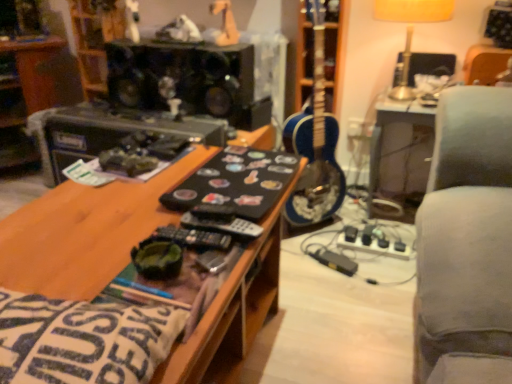
Question: Does white matte toy at upper center, which is counted as the first toy, starting from the left, have a lesser height compared to black matte speaker at upper center?

Choices:
 (A) yes
 (B) no

Answer: (A)

Question: Is white matte toy at upper center, which is counted as the first toy, starting from the left, positioned in front of black matte speaker at upper center?

Choices:
 (A) yes
 (B) no

Answer: (B)

Question: From a real-world perspective, is white matte toy at upper center, which is counted as the first toy, starting from the left, below black matte speaker at upper center?

Choices:
 (A) yes
 (B) no

Answer: (B)

Question: Is white matte toy at upper center, which is counted as the first toy, starting from the left, taller than black matte speaker at upper center?

Choices:
 (A) no
 (B) yes

Answer: (A)

Question: Would you say white matte toy at upper center, which is counted as the third toy, starting from the right, contains black matte speaker at upper center?

Choices:
 (A) yes
 (B) no

Answer: (B)

Question: From the image's perspective, is white fabric pillow at lower left positioned above or below black plastic shelf at upper left?

Choices:
 (A) below
 (B) above

Answer: (A)

Question: Do you think white fabric pillow at lower left is within black plastic shelf at upper left, or outside of it?

Choices:
 (A) outside
 (B) inside

Answer: (A)

Question: Considering the positions of white fabric pillow at lower left and black plastic shelf at upper left in the image, is white fabric pillow at lower left wider or thinner than black plastic shelf at upper left?

Choices:
 (A) thin
 (B) wide

Answer: (A)

Question: In terms of height, does white fabric pillow at lower left look taller or shorter compared to black plastic shelf at upper left?

Choices:
 (A) tall
 (B) short

Answer: (B)

Question: From the image's perspective, is white matte toy at upper center, which is counted as the third toy, starting from the right, located above or below black plastic shelf at upper left?

Choices:
 (A) below
 (B) above

Answer: (B)

Question: From a real-world perspective, is white matte toy at upper center, which is counted as the third toy, starting from the right, physically located above or below black plastic shelf at upper left?

Choices:
 (A) above
 (B) below

Answer: (A)

Question: Is white matte toy at upper center, which is counted as the first toy, starting from the left, bigger or smaller than black plastic shelf at upper left?

Choices:
 (A) small
 (B) big

Answer: (A)

Question: Based on their positions, is white matte toy at upper center, which is counted as the third toy, starting from the right, located to the left or right of black plastic shelf at upper left?

Choices:
 (A) left
 (B) right

Answer: (B)

Question: From the image's perspective, is white matte toy at upper center, which is counted as the first toy, starting from the left, located above or below white plush toy at upper center, acting as the second toy starting from the left?

Choices:
 (A) below
 (B) above

Answer: (B)

Question: Based on their sizes in the image, would you say white matte toy at upper center, which is counted as the third toy, starting from the right, is bigger or smaller than white plush toy at upper center, acting as the second toy starting from the right?

Choices:
 (A) big
 (B) small

Answer: (A)